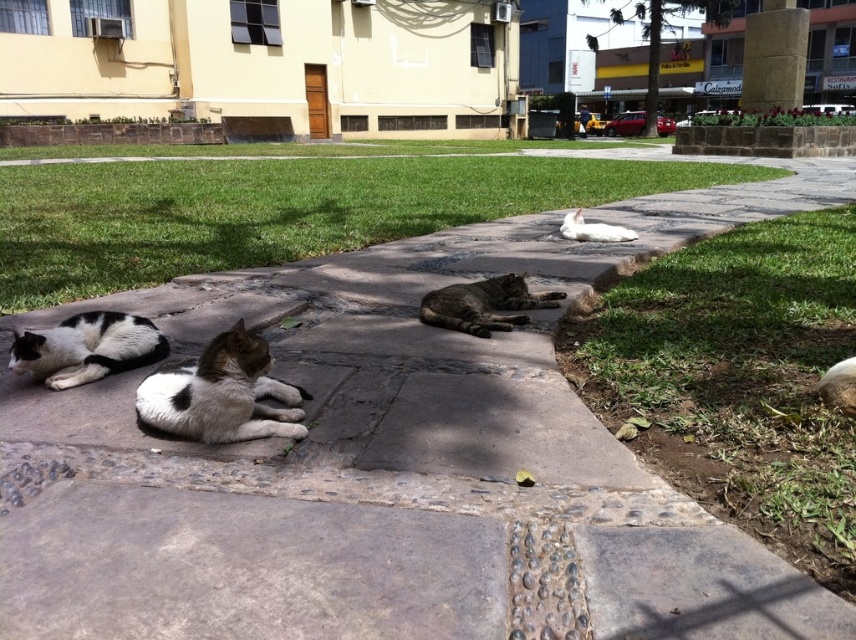
Measure the distance between point (116, 209) and camera.

Point (116, 209) and camera are 7.28 meters apart.

The height and width of the screenshot is (640, 856). Identify the location of green grass at center. (278, 211).

Image resolution: width=856 pixels, height=640 pixels. Describe the element at coordinates (278, 211) in the screenshot. I see `green grass at center` at that location.

Identify the location of green grass at center. (278, 211).

Does green grass at center have a larger size compared to white fur cat at center?

Correct, green grass at center is larger in size than white fur cat at center.

Does green grass at center have a lesser height compared to white fur cat at center?

No, green grass at center is not shorter than white fur cat at center.

Is point (566, 200) in front of point (580, 234)?

No, (566, 200) is behind (580, 234).

Locate an element on the screen. Image resolution: width=856 pixels, height=640 pixels. green grass at center is located at coordinates (278, 211).

Which of these two, gray concrete pavement at center or white and gray fur cat at center, stands shorter?

With less height is gray concrete pavement at center.

Who is more forward, (563,604) or (183,417)?

Point (563,604)

Image resolution: width=856 pixels, height=640 pixels. Find the location of `gray concrete pavement at center`. gray concrete pavement at center is located at coordinates pyautogui.click(x=389, y=465).